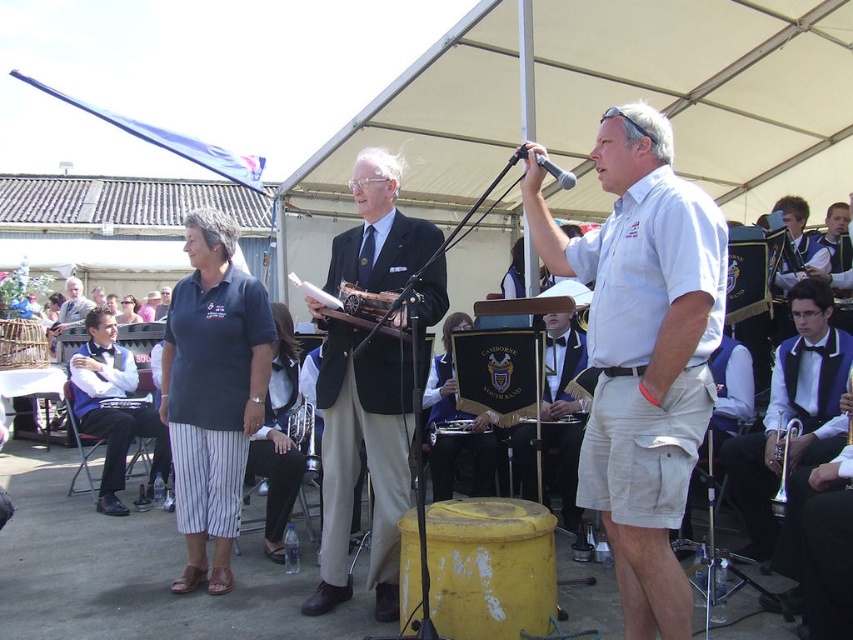
Is matte black suit at center closer to the viewer compared to matte black vest at left?

Yes, matte black suit at center is closer to the viewer.

Image resolution: width=853 pixels, height=640 pixels. What are the coordinates of `matte black suit at center` in the screenshot? It's located at (360, 461).

Between point (831, 340) and point (784, 502), which one is positioned in front?

Point (784, 502) is in front.

Does black satin vest at right appear over brass bell at center?

Yes.

Between point (776, 388) and point (798, 433), which one is positioned behind?

The point (776, 388) is behind.

This screenshot has height=640, width=853. I want to click on black satin vest at right, so click(791, 413).

Which of these two, white cotton shirt at center or wooden microphone at center, stands taller?

With more height is white cotton shirt at center.

Is white cotton shirt at center below wooden microphone at center?

Correct, white cotton shirt at center is located below wooden microphone at center.

Is point (688, 209) farther from viewer compared to point (355, 308)?

No.

Find the location of `white cotton shirt at center`. white cotton shirt at center is located at coordinates (642, 352).